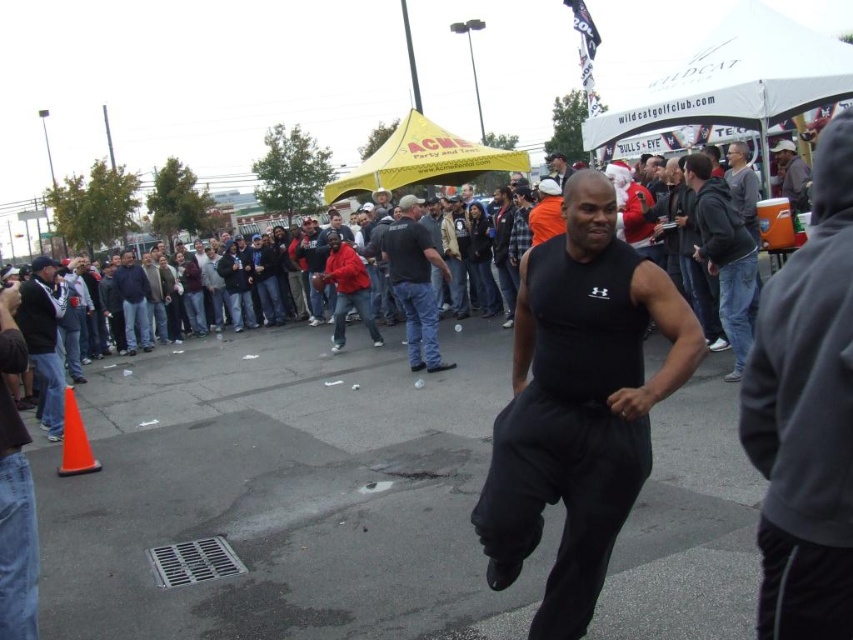
A person wearing dark blue jeans at center is trying to kick a soccer ball towards a target located behind the orange matte traffic cone at lower left. Can they kick the ball past the cone without moving it?

The orange matte traffic cone at lower left is behind dark blue jeans at center, so the person can kick the ball past the cone without moving it since the cone is already positioned behind their location.

You are at an outdoor event and see two people wearing black sleeveless shirts. One is wearing a black sleeveless shirt at center and the other a matte black tank top at center. Which one is positioned to the left?

The black sleeveless shirt at center is positioned to the left of the matte black tank top at center.